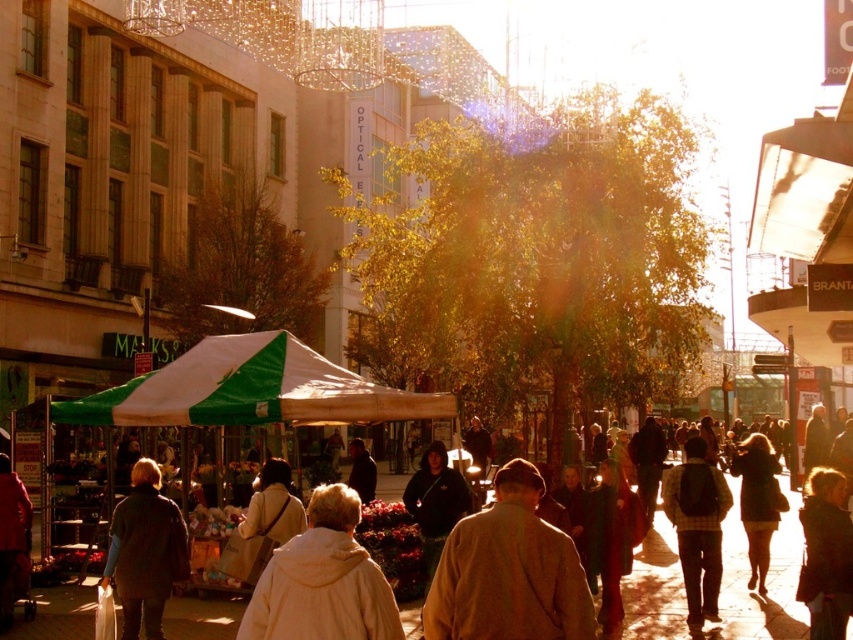
Question: Among these objects, which one is farthest from the camera?

Choices:
 (A) dark brown leather jacket at lower left
 (B) brown woolen coat at center
 (C) white fleece jacket at center

Answer: (A)

Question: Is green/white fabric canopy at center positioned at the back of dark brown leather jacket at lower right?

Choices:
 (A) yes
 (B) no

Answer: (B)

Question: Does green/white fabric canopy at center have a smaller size compared to dark brown leather jacket at center?

Choices:
 (A) yes
 (B) no

Answer: (A)

Question: Observing the image, what is the correct spatial positioning of dark brown leather jacket at lower left in reference to dark brown leather jacket at lower right?

Choices:
 (A) above
 (B) below

Answer: (B)

Question: Which object is farther from the camera taking this photo?

Choices:
 (A) brown woolen coat at center
 (B) white fleece jacket at center
 (C) dark brown leather jacket at lower right

Answer: (C)

Question: Which of these objects is positioned closest to the white fleece jacket at center?

Choices:
 (A) dark brown leather jacket at lower right
 (B) green/white fabric canopy at center

Answer: (B)